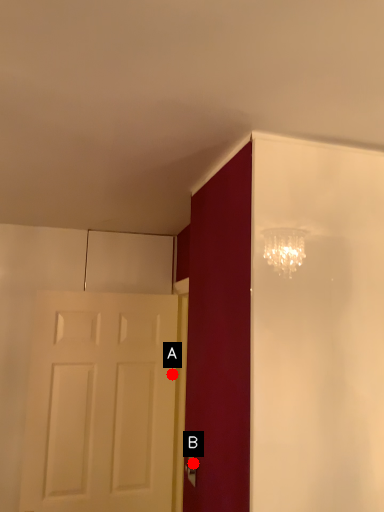
Question: Two points are circled on the image, labeled by A and B beside each circle. Which point is closer to the camera?

Choices:
 (A) A is closer
 (B) B is closer

Answer: (B)